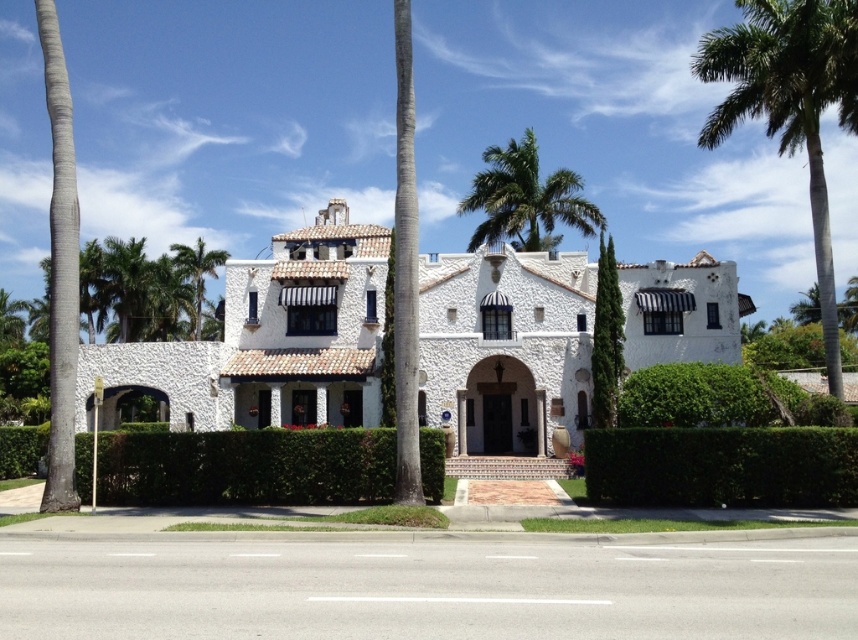
Is green leafy hedge at lower right above green leafy palm tree at left?

No, green leafy hedge at lower right is not above green leafy palm tree at left.

Between green leafy hedge at lower right and green leafy palm tree at left, which one is positioned lower?

green leafy hedge at lower right is below.

The height and width of the screenshot is (640, 858). Identify the location of green leafy hedge at lower right. (721, 467).

I want to click on green leafy hedge at lower right, so click(721, 467).

Between green leafy hedge at lower center and green leafy palm tree at upper center, which one has less height?

green leafy hedge at lower center

Is point (433, 458) in front of point (594, 230)?

Yes, it is in front of point (594, 230).

Who is more distant from viewer, (152, 476) or (603, 221)?

Point (603, 221)

Image resolution: width=858 pixels, height=640 pixels. Find the location of `green leafy hedge at lower center`. green leafy hedge at lower center is located at coordinates (246, 467).

Between point (585, 356) and point (632, 390), which one is positioned behind?

Positioned behind is point (585, 356).

Is white stucco mansion at center to the left of green leafy hedge at center from the viewer's perspective?

Yes, white stucco mansion at center is to the left of green leafy hedge at center.

Between point (133, 378) and point (695, 387), which one is positioned behind?

Positioned behind is point (133, 378).

Where is `white stucco mansion at center`? The height and width of the screenshot is (640, 858). white stucco mansion at center is located at coordinates (269, 340).